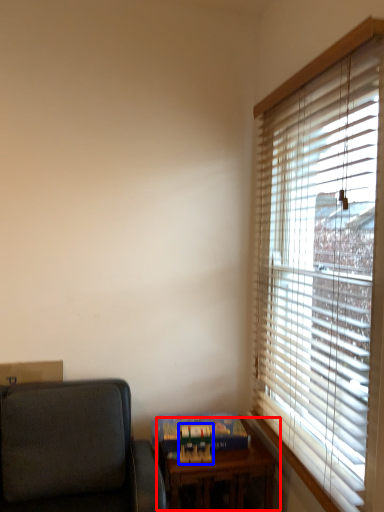
Question: Which object is closer to the camera taking this photo, table (highlighted by a red box) or paperback book (highlighted by a blue box)?

Choices:
 (A) table
 (B) paperback book

Answer: (A)